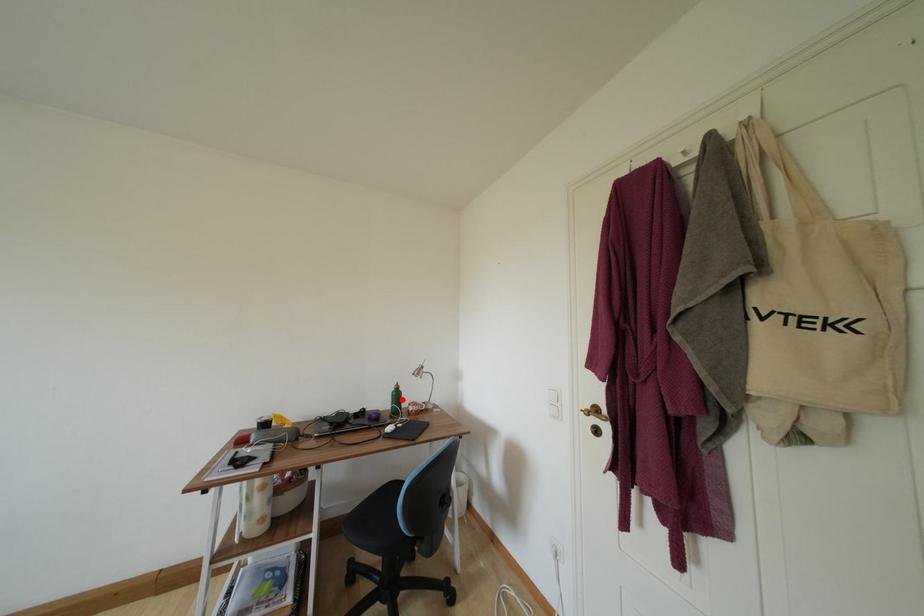
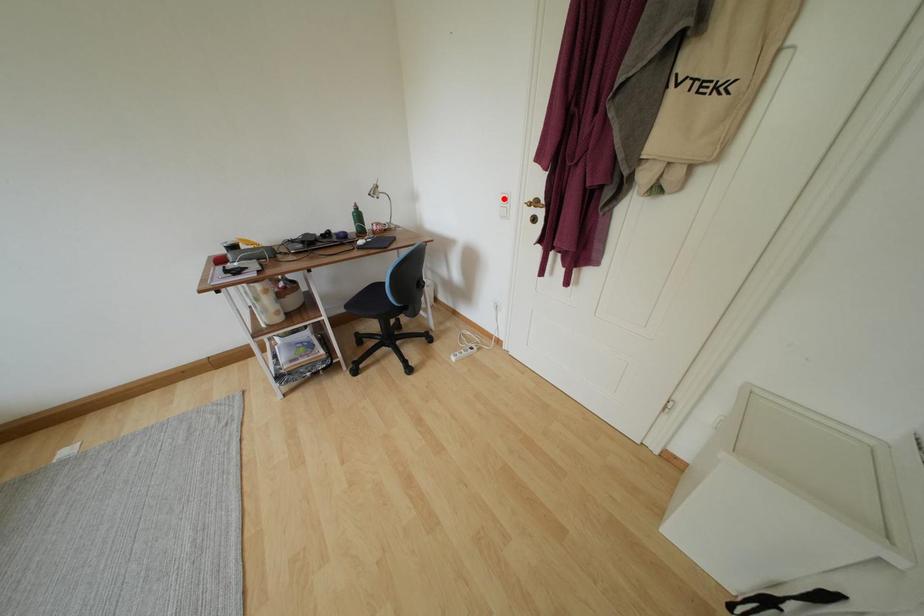
I am providing you with two images of the same scene from different viewpoints. A red point is marked on the first image and another point is marked on the second image. Is the marked point in image1 the same physical position as the marked point in image2?

No